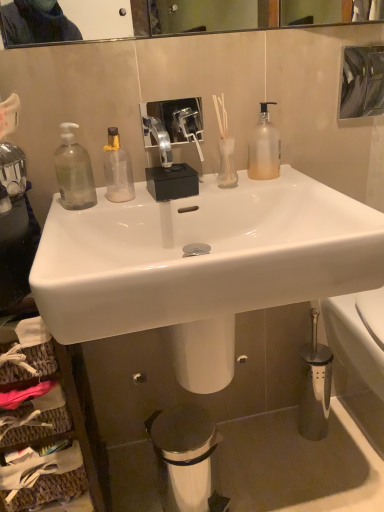
Where is `vacant space underneath metallic trash can at lower center (from a real-world perspective)`? Image resolution: width=384 pixels, height=512 pixels. vacant space underneath metallic trash can at lower center (from a real-world perspective) is located at coordinates (191, 490).